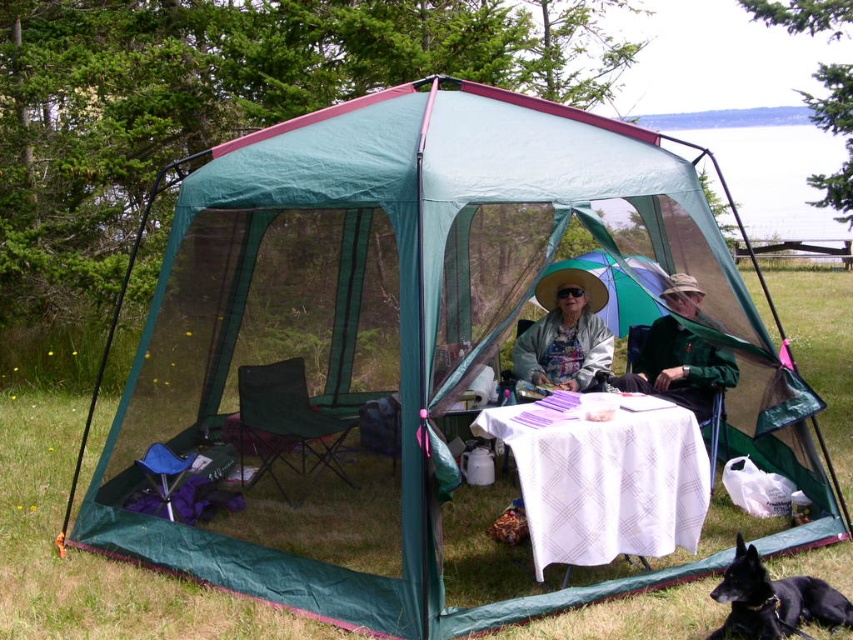
Question: Does matte green hat at center have a larger size compared to black fur dog at lower right?

Choices:
 (A) yes
 (B) no

Answer: (A)

Question: Does white cloth table at center have a greater width compared to green fabric hat at upper center?

Choices:
 (A) no
 (B) yes

Answer: (B)

Question: Which point is closer to the camera?

Choices:
 (A) (585, 518)
 (B) (647, 358)
 (C) (747, 556)

Answer: (C)

Question: Does green fabric hat at upper center appear on the right side of black fur dog at lower right?

Choices:
 (A) yes
 (B) no

Answer: (B)

Question: Which point is farther from the camera taking this photo?

Choices:
 (A) (686, 426)
 (B) (721, 380)
 (C) (799, 624)

Answer: (B)

Question: Which point is farther from the camera taking this photo?

Choices:
 (A) (694, 493)
 (B) (682, 356)
 (C) (585, 298)
 (D) (830, 586)

Answer: (C)